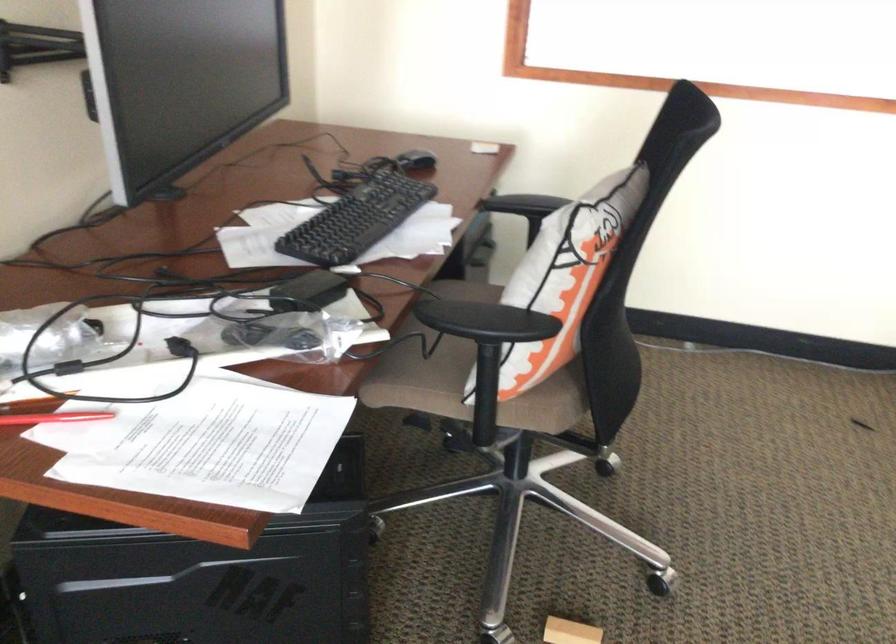
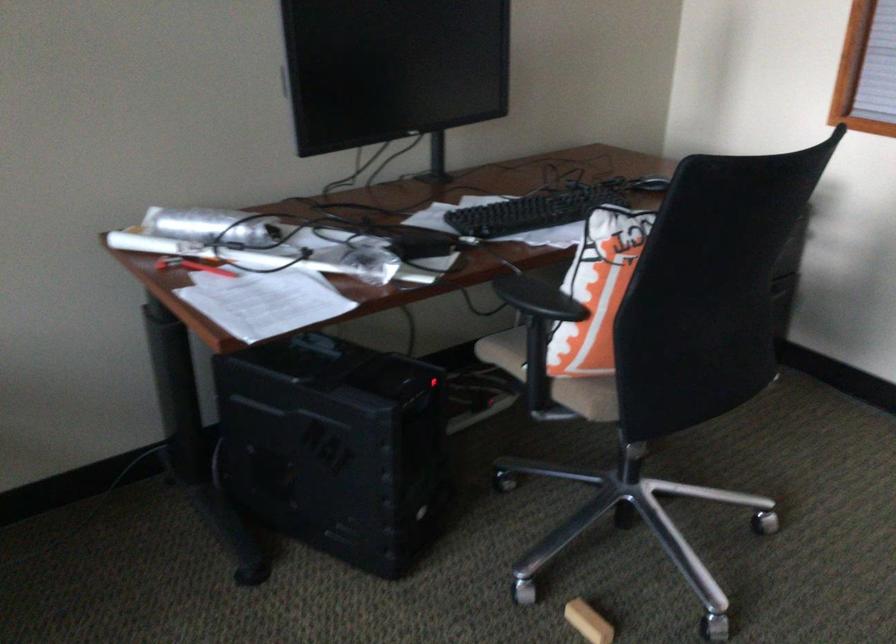
Find the pixel in the second image that matches point (574, 295) in the first image.

(597, 290)